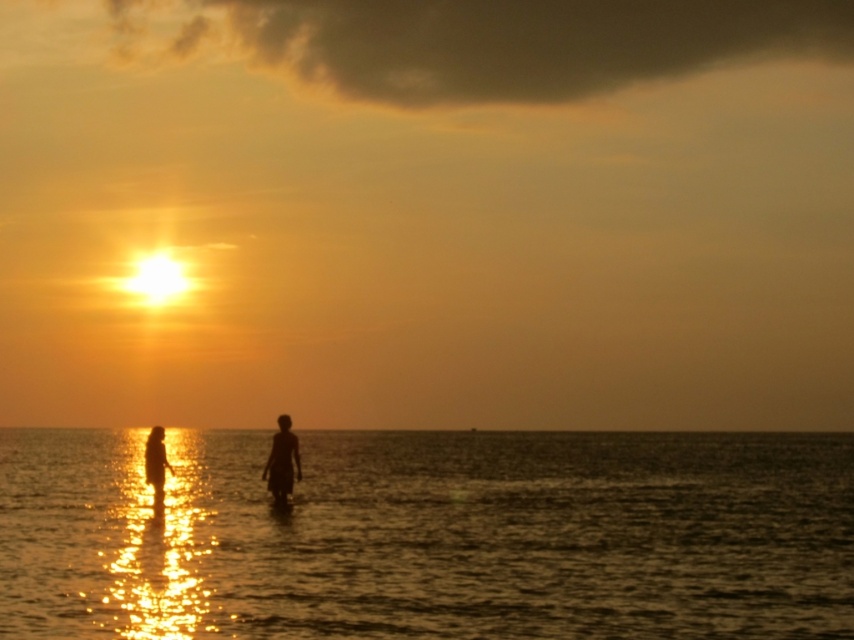
Is shiny reflective water at center thinner than silhouette figure at lower left?

In fact, shiny reflective water at center might be wider than silhouette figure at lower left.

From the picture: Who is higher up, shiny reflective water at center or silhouette figure at lower left?

Positioned higher is silhouette figure at lower left.

Locate an element on the screen. shiny reflective water at center is located at coordinates (428, 536).

Can you confirm if silhouette figure at center is positioned above silhouette figure at lower left?

Yes.

Who is lower down, silhouette figure at center or silhouette figure at lower left?

silhouette figure at lower left is lower down.

Does point (278, 440) come farther from viewer compared to point (145, 460)?

No, (278, 440) is in front of (145, 460).

I want to click on silhouette figure at center, so click(282, 461).

Which is in front, point (446, 584) or point (278, 429)?

Point (446, 584)

Does shiny reflective water at center have a greater height compared to silhouette figure at center?

Yes, shiny reflective water at center is taller than silhouette figure at center.

Measure the distance between shiny reflective water at center and camera.

shiny reflective water at center is 18.02 meters away from camera.

Locate an element on the screen. This screenshot has height=640, width=854. shiny reflective water at center is located at coordinates (428, 536).